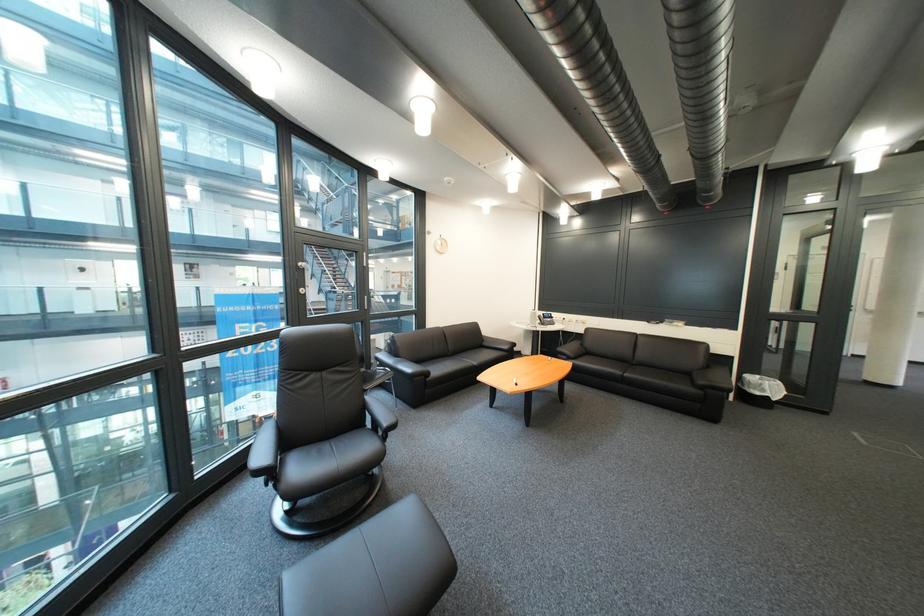
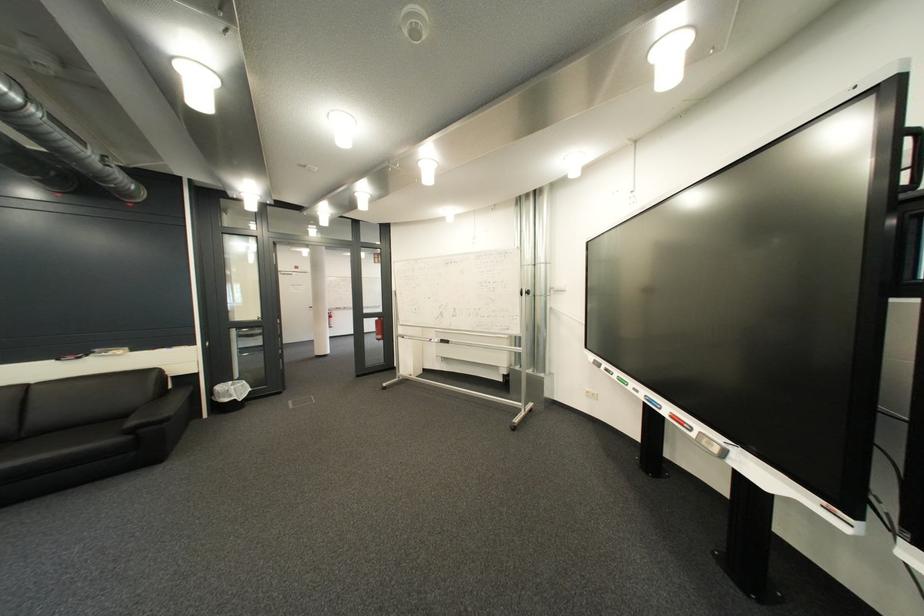
Find the pixel in the second image that matches pixel 647 367 in the first image.

(35, 440)